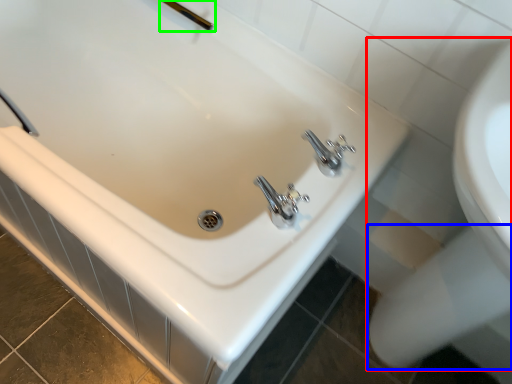
Question: Estimate the real-world distances between objects in this image. Which object is farther from sink (highlighted by a red box), bidet (highlighted by a blue box) or shower (highlighted by a green box)?

Choices:
 (A) bidet
 (B) shower

Answer: (B)